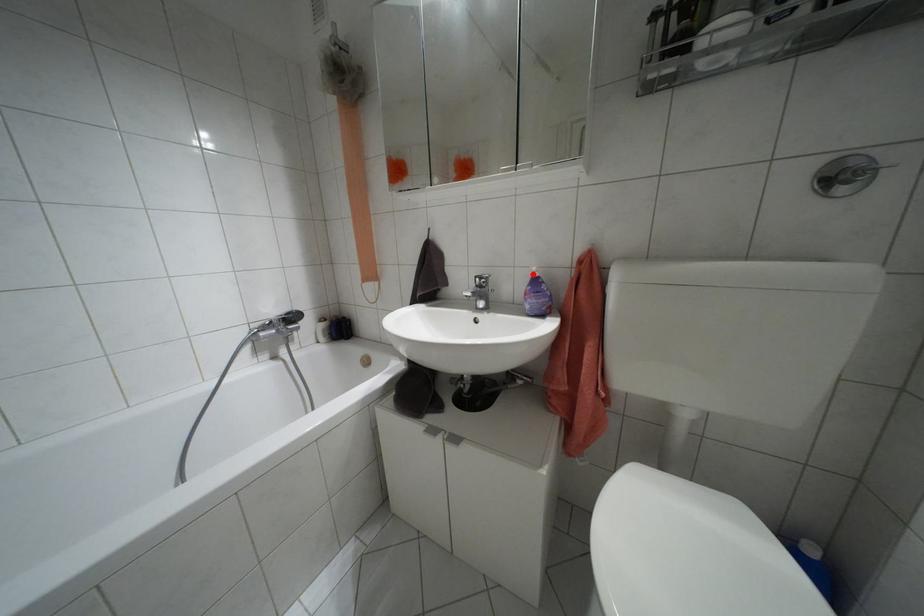
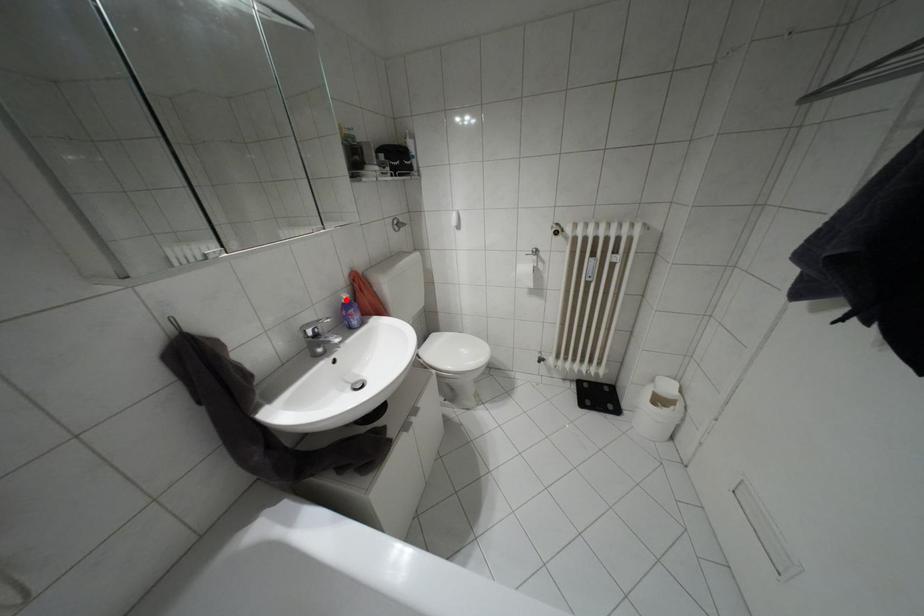
I am providing you with two images of the same scene from different viewpoints. A red point is marked on the first image and another point is marked on the second image. Is the red point in image1 aligned with the point shown in image2?

Yes